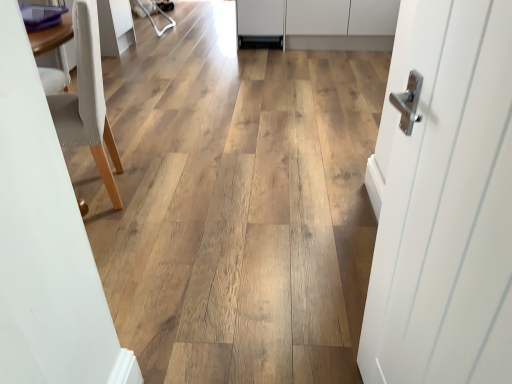
You are a GUI agent. You are given a task and a screenshot of the screen. Output one action in this format:
    pyautogui.click(x=<x>, y=<y>)
    Task: Click on the vacant space in light beige fabric chair at left (from a real-world perspective)
    This screenshot has height=384, width=512.
    Given the screenshot: What is the action you would take?
    pyautogui.click(x=97, y=183)